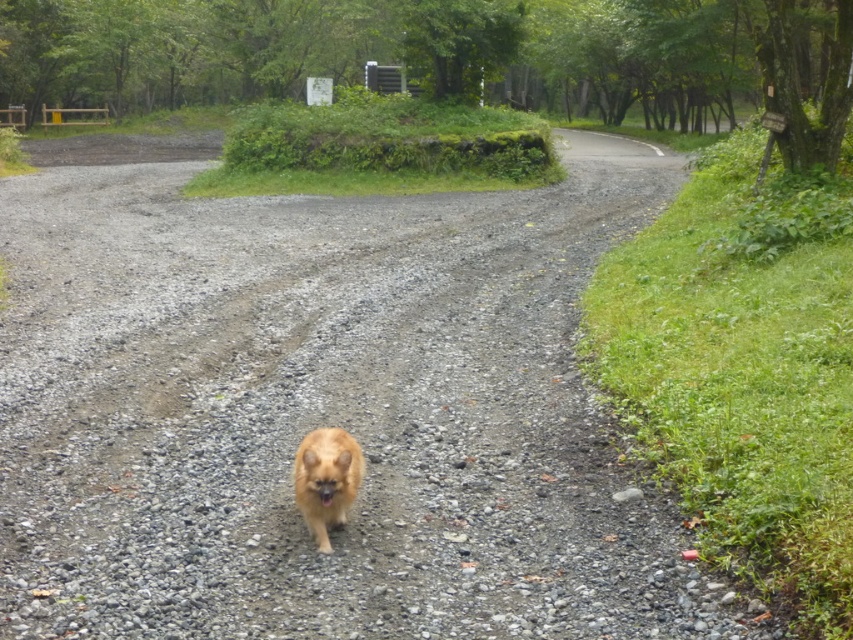
Looking at this image, you are standing at the starting point of the gravel path and want to reach the end point. The path has two marked points labeled as point (24, 205) and point (305, 490). Which of these points will you encounter first while walking along the path towards the end?

Point (305, 490) will be encountered first because it is in front of point (24, 205) along the path.

You are a photographer trying to capture the golden fur dog at center while standing on the gray gravel at center. Considering the height difference between the two, how should you adjust your camera angle to get the best shot?

Since the gray gravel at center is taller than the golden fur dog at center, you should lower your camera angle to ensure the dog is clearly visible without obstruction from the gravel.